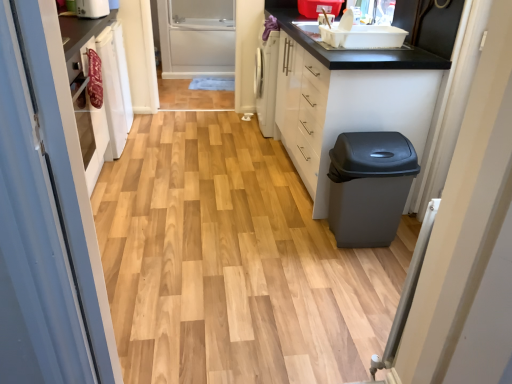
The width and height of the screenshot is (512, 384). What do you see at coordinates (92, 8) in the screenshot?
I see `white plastic toaster at upper left` at bounding box center [92, 8].

Find the location of a particular element. wooden floor at center is located at coordinates (234, 262).

What do you see at coordinates (352, 92) in the screenshot? This screenshot has width=512, height=384. I see `white glossy cabinet at right` at bounding box center [352, 92].

At what (x,y) coordinates should I click in order to perform the action: click on matte gray trash can at right. Please return your answer as a coordinate pair (x, y). This screenshot has height=384, width=512. Looking at the image, I should click on [x=369, y=186].

This screenshot has height=384, width=512. What do you see at coordinates (196, 37) in the screenshot?
I see `clear glass screen door at center` at bounding box center [196, 37].

Find the location of a particular element. Image resolution: width=512 pixels, height=384 pixels. white plastic toaster at upper left is located at coordinates (92, 8).

From a real-world perspective, who is located lower, white glossy cabinet at right or matte gray trash can at right?

matte gray trash can at right.

Does white glossy cabinet at right have a greater width compared to matte gray trash can at right?

Correct, the width of white glossy cabinet at right exceeds that of matte gray trash can at right.

Is matte gray trash can at right at the back of white glossy cabinet at right?

No.

Which of these two, white glossy cabinet at right or matte gray trash can at right, is smaller?

With smaller size is matte gray trash can at right.

How different are the orientations of matte gray trash can at right and wooden floor at center in degrees?

2.87 degrees separate the facing orientations of matte gray trash can at right and wooden floor at center.

In the scene shown: Considering the sizes of objects matte gray trash can at right and wooden floor at center in the image provided, who is smaller, matte gray trash can at right or wooden floor at center?

matte gray trash can at right.

Considering the points (373, 177) and (202, 349), which point is behind, point (373, 177) or point (202, 349)?

Point (373, 177)

Between matte gray trash can at right and wooden floor at center, which one has more height?

Standing taller between the two is matte gray trash can at right.

From a real-world perspective, does clear glass screen door at center stand above white plastic toaster at upper left?

No, from a real-world perspective, clear glass screen door at center is not above white plastic toaster at upper left.

How many degrees apart are the facing directions of clear glass screen door at center and white plastic toaster at upper left?

There is a 73.1-degree angle between the facing directions of clear glass screen door at center and white plastic toaster at upper left.

Would you consider clear glass screen door at center to be distant from white plastic toaster at upper left?

Yes.

Where is `screen door to the right of white plastic toaster at upper left`? The width and height of the screenshot is (512, 384). screen door to the right of white plastic toaster at upper left is located at coordinates (196, 37).

What's the angular difference between clear glass screen door at center and matte gray trash can at right's facing directions?

They differ by 3 degrees in their facing directions.

Are clear glass screen door at center and matte gray trash can at right located far from each other?

Yes.

Is clear glass screen door at center at the left side of matte gray trash can at right?

Indeed, clear glass screen door at center is positioned on the left side of matte gray trash can at right.

Is clear glass screen door at center completely or partially outside of matte gray trash can at right?

Indeed, clear glass screen door at center is completely outside matte gray trash can at right.

Could white plastic toaster at upper left be considered to be inside wooden floor at center?

No, white plastic toaster at upper left is not inside wooden floor at center.

From a real-world perspective, is wooden floor at center physically located above or below white plastic toaster at upper left?

wooden floor at center is below white plastic toaster at upper left.

Based on the photo, in the image, is wooden floor at center positioned in front of or behind white plastic toaster at upper left?

wooden floor at center is positioned closer to the viewer than white plastic toaster at upper left.

Can you see wooden floor at center touching white plastic toaster at upper left?

No, wooden floor at center is not touching white plastic toaster at upper left.

Is the position of matte gray trash can at right more distant than that of clear glass screen door at center?

No, matte gray trash can at right is closer to the camera.

Is matte gray trash can at right to the left of clear glass screen door at center from the viewer's perspective?

In fact, matte gray trash can at right is to the right of clear glass screen door at center.

Is there a large distance between matte gray trash can at right and clear glass screen door at center?

Yes, matte gray trash can at right and clear glass screen door at center are quite far apart.

Is the position of white plastic toaster at upper left more distant than that of matte gray trash can at right?

Yes, white plastic toaster at upper left is further from the camera.

From the image's perspective, is white plastic toaster at upper left beneath matte gray trash can at right?

Incorrect, from the image's perspective, white plastic toaster at upper left is higher than matte gray trash can at right.

From a real-world perspective, is white plastic toaster at upper left located beneath matte gray trash can at right?

No, from a real-world perspective, white plastic toaster at upper left is not below matte gray trash can at right.

Is white plastic toaster at upper left positioned far away from matte gray trash can at right?

That's right, there is a large distance between white plastic toaster at upper left and matte gray trash can at right.

Image resolution: width=512 pixels, height=384 pixels. I want to click on waste container lying on the right of white glossy cabinet at right, so click(x=369, y=186).

Find the location of a particular element. The width and height of the screenshot is (512, 384). waste container above the wooden floor at center (from a real-world perspective) is located at coordinates (369, 186).

Based on their spatial positions, is matte gray trash can at right or white plastic toaster at upper left further from clear glass screen door at center?

Based on the image, matte gray trash can at right appears to be further to clear glass screen door at center.

From the image, which object appears to be farther from white glossy cabinet at right, clear glass screen door at center or wooden floor at center?

Based on the image, clear glass screen door at center appears to be further to white glossy cabinet at right.

In the scene shown: Which object lies nearer to the anchor point white plastic toaster at upper left, matte gray trash can at right or clear glass screen door at center?

matte gray trash can at right lies closer to white plastic toaster at upper left than the other object.

When comparing their distances from wooden floor at center, does matte gray trash can at right or white glossy cabinet at right seem closer?

The object closer to wooden floor at center is matte gray trash can at right.

Which object lies further to the anchor point wooden floor at center, clear glass screen door at center or white plastic toaster at upper left?

Based on the image, clear glass screen door at center appears to be further to wooden floor at center.

When comparing their distances from matte gray trash can at right, does white glossy cabinet at right or white plastic toaster at upper left seem closer?

white glossy cabinet at right is closer to matte gray trash can at right.

From the image, which object appears to be farther from matte gray trash can at right, white plastic toaster at upper left or clear glass screen door at center?

clear glass screen door at center is further to matte gray trash can at right.

Which object lies further to the anchor point white glossy cabinet at right, wooden floor at center or white plastic toaster at upper left?

white plastic toaster at upper left is further to white glossy cabinet at right.

The image size is (512, 384). I want to click on plain situated between white plastic toaster at upper left and white glossy cabinet at right from left to right, so click(234, 262).

This screenshot has height=384, width=512. Identify the location of cabinetry between wooden floor at center and matte gray trash can at right. (352, 92).

At what (x,y) coordinates should I click in order to perform the action: click on cabinetry between matte gray trash can at right and clear glass screen door at center in the front-back direction. Please return your answer as a coordinate pair (x, y). The width and height of the screenshot is (512, 384). Looking at the image, I should click on (352, 92).

Identify the location of screen door between white plastic toaster at upper left and matte gray trash can at right. (196, 37).